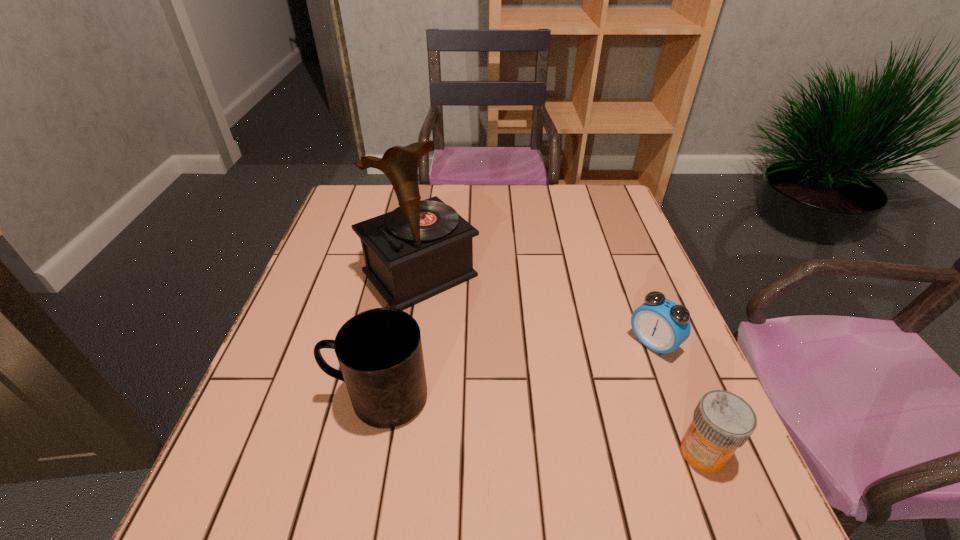
The image size is (960, 540). In order to click on medicine that is at the right edge in this screenshot , I will do `click(722, 421)`.

Where is `alarm clock that is positioned at the right edge`? alarm clock that is positioned at the right edge is located at coordinates (660, 324).

Find the location of a particular element. object at the near left corner is located at coordinates (379, 351).

What are the coordinates of `object that is at the near right corner` in the screenshot? It's located at (722, 421).

In the image, there is a desktop. Where is `free space at the far edge`? This screenshot has width=960, height=540. free space at the far edge is located at coordinates (545, 195).

This screenshot has height=540, width=960. In the image, there is a desktop. What are the coordinates of `vacant area at the near edge` in the screenshot? It's located at (566, 465).

I want to click on free space at the left edge, so click(x=295, y=355).

At what (x,y) coordinates should I click in order to perform the action: click on vacant space at the right edge of the desktop. Please return your answer as a coordinate pair (x, y). The height and width of the screenshot is (540, 960). Looking at the image, I should click on (609, 277).

In the image, there is a desktop. Identify the location of vacant space at the near left corner. (301, 437).

In the image, there is a desktop. Where is `vacant space at the far right corner`? The width and height of the screenshot is (960, 540). vacant space at the far right corner is located at coordinates (575, 195).